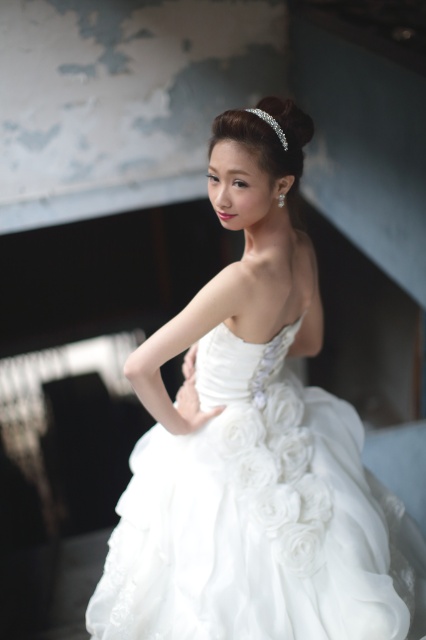
Question: Is white satin dress at center to the left of clear crystal tiara at upper center from the viewer's perspective?

Choices:
 (A) yes
 (B) no

Answer: (A)

Question: Is white satin dress at center positioned at the back of clear crystal tiara at upper center?

Choices:
 (A) no
 (B) yes

Answer: (A)

Question: Which point is farther to the camera?

Choices:
 (A) (281, 129)
 (B) (331, 448)

Answer: (B)

Question: Does white satin dress at center have a lesser width compared to clear crystal tiara at upper center?

Choices:
 (A) no
 (B) yes

Answer: (A)